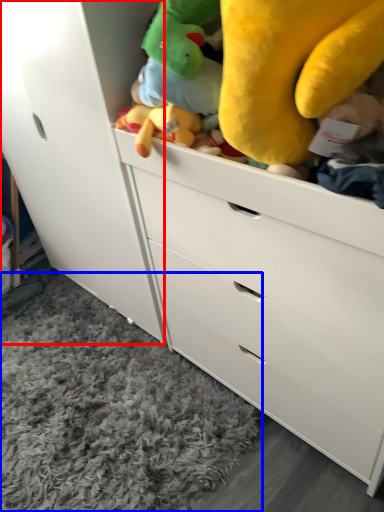
Question: Which point is further to the camera, cabinetry (highlighted by a red box) or plain (highlighted by a blue box)?

Choices:
 (A) cabinetry
 (B) plain

Answer: (B)